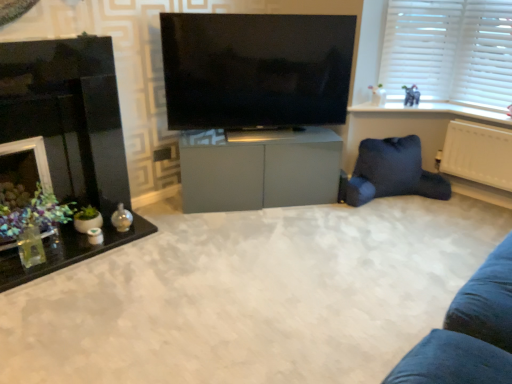
At what (x,y) coordinates should I click in order to perform the action: click on free area in between translucent glass table at left and black glossy fireplace at left. Please return your answer as a coordinate pair (x, y). This screenshot has height=384, width=512. Looking at the image, I should click on (117, 251).